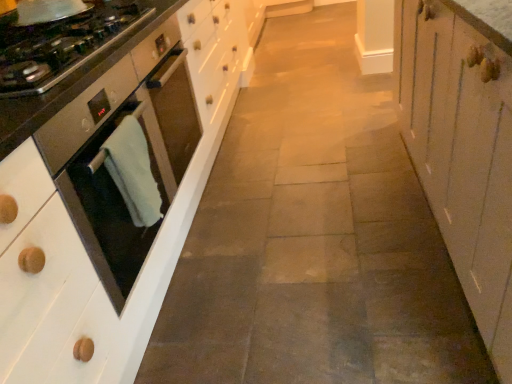
Question: Is satin black oven at left in front of green towel at left?

Choices:
 (A) no
 (B) yes

Answer: (B)

Question: From a real-world perspective, is satin black oven at left positioned under green towel at left based on gravity?

Choices:
 (A) yes
 (B) no

Answer: (A)

Question: From a real-world perspective, is satin black oven at left located higher than green towel at left?

Choices:
 (A) no
 (B) yes

Answer: (A)

Question: Is satin black oven at left further to the viewer compared to green towel at left?

Choices:
 (A) no
 (B) yes

Answer: (A)

Question: Is satin black oven at left at the left side of green towel at left?

Choices:
 (A) yes
 (B) no

Answer: (A)

Question: From the image's perspective, relative to white wood cabinet at right, is satin steel oven at left above or below?

Choices:
 (A) below
 (B) above

Answer: (B)

Question: From a real-world perspective, is satin steel oven at left physically located above or below white wood cabinet at right?

Choices:
 (A) above
 (B) below

Answer: (A)

Question: Would you say satin steel oven at left is to the left or to the right of white wood cabinet at right in the picture?

Choices:
 (A) left
 (B) right

Answer: (A)

Question: Is satin steel oven at left taller or shorter than white wood cabinet at right?

Choices:
 (A) short
 (B) tall

Answer: (A)

Question: Is point (137, 178) positioned closer to the camera than point (497, 97)?

Choices:
 (A) farther
 (B) closer

Answer: (A)

Question: In terms of width, does green towel at left look wider or thinner when compared to white wood cabinet at right?

Choices:
 (A) wide
 (B) thin

Answer: (B)

Question: In the image, is green towel at left on the left side or the right side of white wood cabinet at right?

Choices:
 (A) right
 (B) left

Answer: (B)

Question: Considering the positions of green towel at left and white wood cabinet at right in the image, is green towel at left taller or shorter than white wood cabinet at right?

Choices:
 (A) tall
 (B) short

Answer: (B)

Question: Looking at their shapes, would you say satin black oven at left is wider or thinner than satin steel oven at left?

Choices:
 (A) wide
 (B) thin

Answer: (A)

Question: Choose the correct answer: Is satin black oven at left inside satin steel oven at left or outside it?

Choices:
 (A) outside
 (B) inside

Answer: (A)